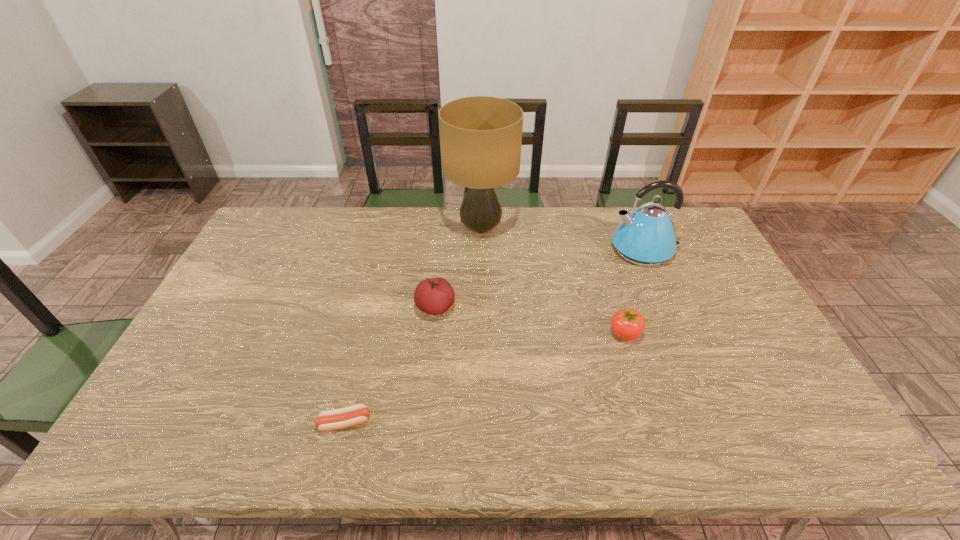
The image size is (960, 540). What are the coordinates of `the tallest object` in the screenshot? It's located at (480, 136).

In order to click on kettle in this screenshot , I will do `click(646, 237)`.

Locate an element on the screen. the third shortest object is located at coordinates (434, 296).

Image resolution: width=960 pixels, height=540 pixels. Find the location of `the left tomato`. the left tomato is located at coordinates (434, 296).

Identify the location of the shorter tomato. (628, 324).

Locate an element on the screen. This screenshot has width=960, height=540. the right tomato is located at coordinates (628, 324).

Locate an element on the screen. The height and width of the screenshot is (540, 960). the nearest object is located at coordinates (328, 420).

The height and width of the screenshot is (540, 960). Find the location of `the shortest object`. the shortest object is located at coordinates (328, 420).

Locate an element on the screen. free space located on the left of the tallest object is located at coordinates (413, 228).

Image resolution: width=960 pixels, height=540 pixels. What are the coordinates of `free space located at the spout of the kettle` in the screenshot? It's located at (527, 249).